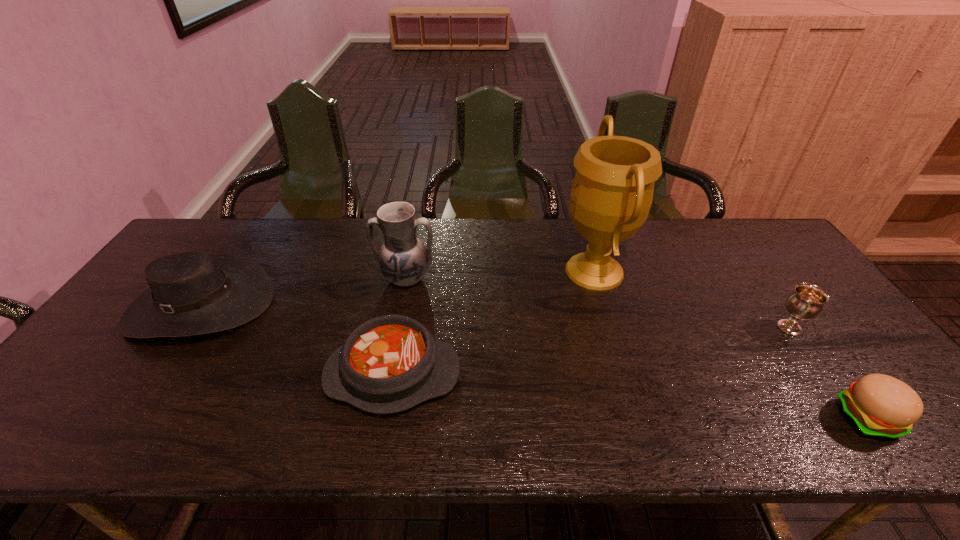
The width and height of the screenshot is (960, 540). Identify the location of free space that satisfies the following two spatial constraints: 1. on the back side of the chalice; 2. on the engravings side of the trophy. pos(749,271).

I want to click on vacant space that satisfies the following two spatial constraints: 1. on the engravings side of the tallest object; 2. on the front-facing side of the second tallest object, so click(x=597, y=278).

What are the coordinates of `free space that satisfies the following two spatial constraints: 1. on the engravings side of the fourth object from left to right; 2. on the left side of the hamburger` in the screenshot? It's located at (639, 418).

This screenshot has width=960, height=540. Identify the location of free region that satisfies the following two spatial constraints: 1. on the engravings side of the chalice; 2. on the left side of the tallest object. (612, 328).

At what (x,y) coordinates should I click in order to perform the action: click on vacant region that satisfies the following two spatial constraints: 1. on the engravings side of the trophy; 2. on the right side of the hamburger. Please return your answer as a coordinate pair (x, y). This screenshot has height=540, width=960. Looking at the image, I should click on (639, 418).

Where is `free region that satisfies the following two spatial constraints: 1. on the engravings side of the trophy; 2. on the front-facing side of the leftmost object`? The width and height of the screenshot is (960, 540). free region that satisfies the following two spatial constraints: 1. on the engravings side of the trophy; 2. on the front-facing side of the leftmost object is located at coordinates (605, 305).

This screenshot has height=540, width=960. Find the location of `free space that satisfies the following two spatial constraints: 1. on the engravings side of the third object from right to left; 2. on the right side of the hamburger`. free space that satisfies the following two spatial constraints: 1. on the engravings side of the third object from right to left; 2. on the right side of the hamburger is located at coordinates (639, 418).

Image resolution: width=960 pixels, height=540 pixels. Identify the location of blank space that satisfies the following two spatial constraints: 1. on the front-facing side of the fourth shortest object; 2. on the left side of the chalice. (186, 328).

I want to click on vacant space that satisfies the following two spatial constraints: 1. on the engravings side of the third object from right to left; 2. on the left side of the chalice, so click(612, 328).

Locate an element on the screen. This screenshot has width=960, height=540. free point that satisfies the following two spatial constraints: 1. on the back side of the casserole; 2. on the right side of the chalice is located at coordinates [x=401, y=328].